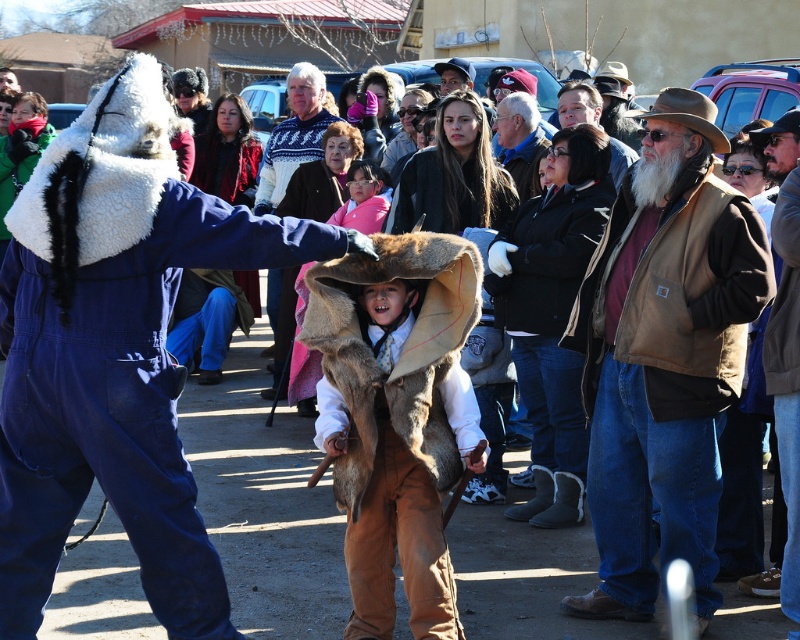
From the picture: You are a photographer at the event and want to capture a photo of the knitted sweater at center and brown leather jacket at center. Which object should you focus on first if you want to ensure both are in focus without adjusting the camera settings?

You should focus on the knitted sweater at center first because it is closer to the viewer than the brown leather jacket at center. By focusing on the closer object, the farther one may still be within the depth of field, ensuring both are in focus without needing to adjust settings.

You are organizing a costume party and need to decide which outfit to wear. You have a brown suede vest at center and a knitted sweater at center. Which one would you choose if you want to wear the larger one?

The brown suede vest at center is bigger than the knitted sweater at center. Therefore, you should choose the brown suede vest at center if you want to wear the larger one.

From the picture: You are standing at the event and want to take a photo of the point at coordinates (280, 314). The camera you have can focus clearly up to 10 meters. Will the point be in focus?

The distance of point (280, 314) from viewer is 12.23 meters, which is beyond the camera focus limit of 10 meters. The point will not be in focus.